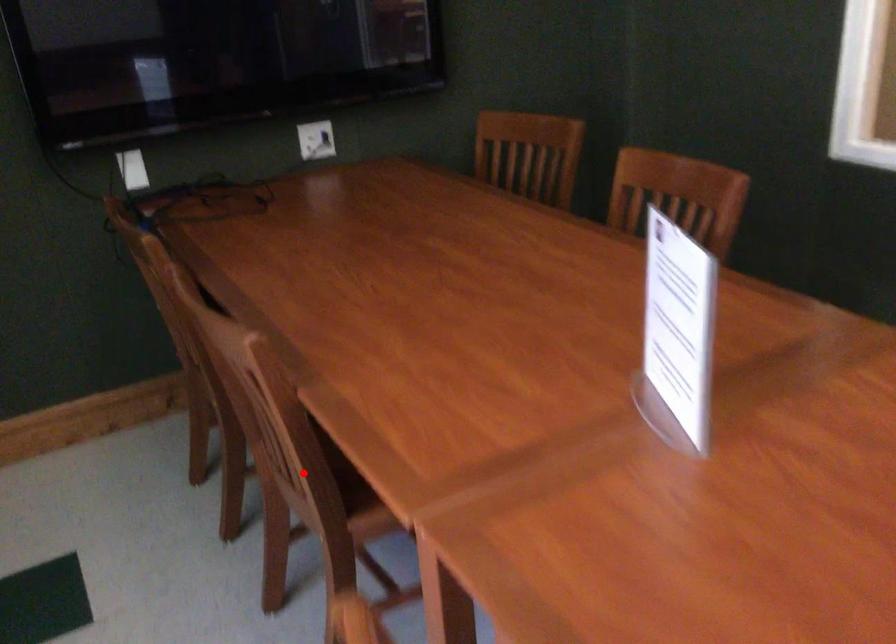
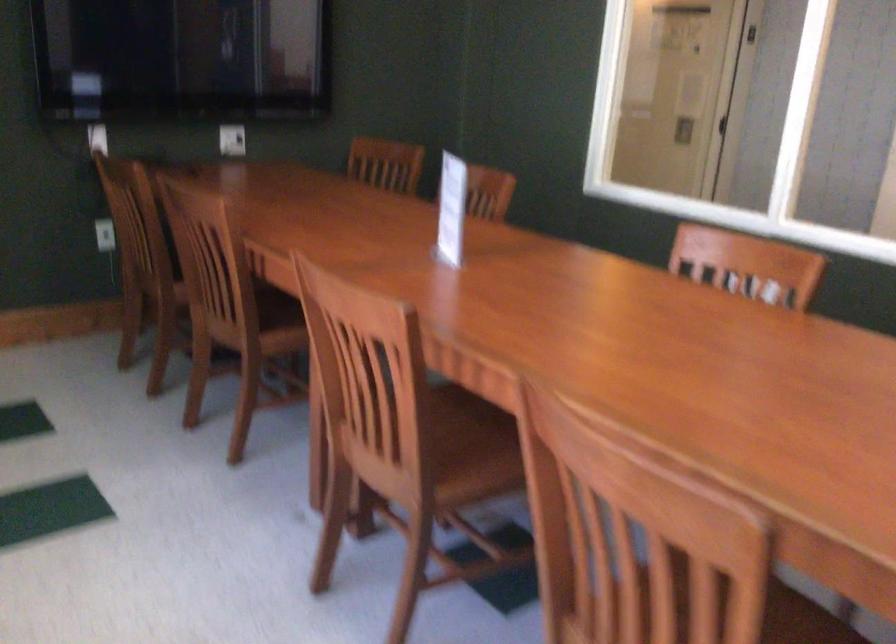
Question: I am providing you with two images of the same scene from different viewpoints. In image1, a red point is highlighted. Considering the same 3D point in image2, which of the following is correct?

Choices:
 (A) It is closer
 (B) It is farther

Answer: (B)